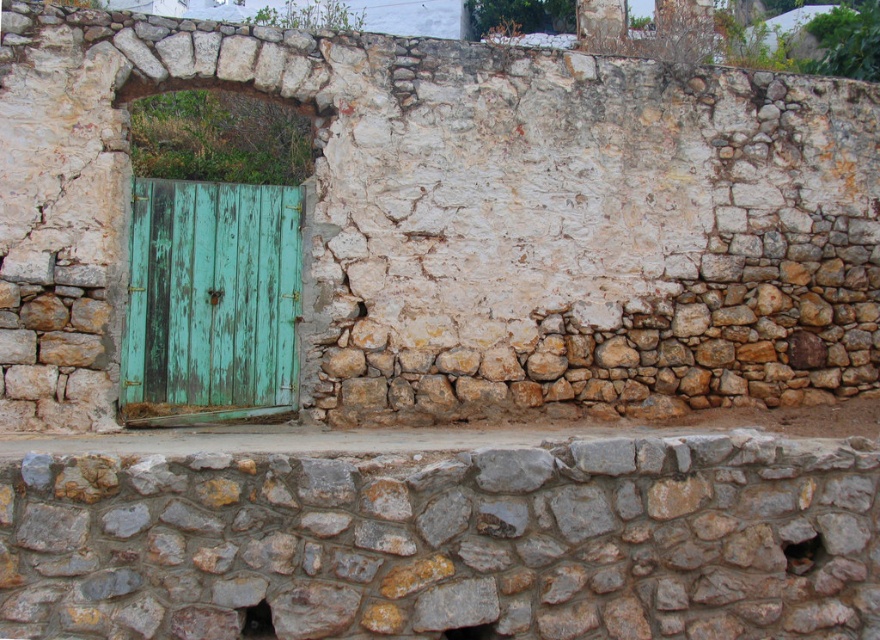
Question: Which object is farther from the camera taking this photo?

Choices:
 (A) rustic stone wall at center
 (B) green weathered wood door at left

Answer: (B)

Question: Is rustic stone wall at center in front of green weathered wood door at left?

Choices:
 (A) yes
 (B) no

Answer: (A)

Question: From the image, what is the correct spatial relationship of rustic stone wall at center in relation to green weathered wood door at left?

Choices:
 (A) above
 (B) below

Answer: (B)

Question: From the image, what is the correct spatial relationship of rustic stone wall at center in relation to green weathered wood door at left?

Choices:
 (A) left
 (B) right

Answer: (B)

Question: Which point appears closest to the camera in this image?

Choices:
 (A) (247, 252)
 (B) (452, 536)

Answer: (B)